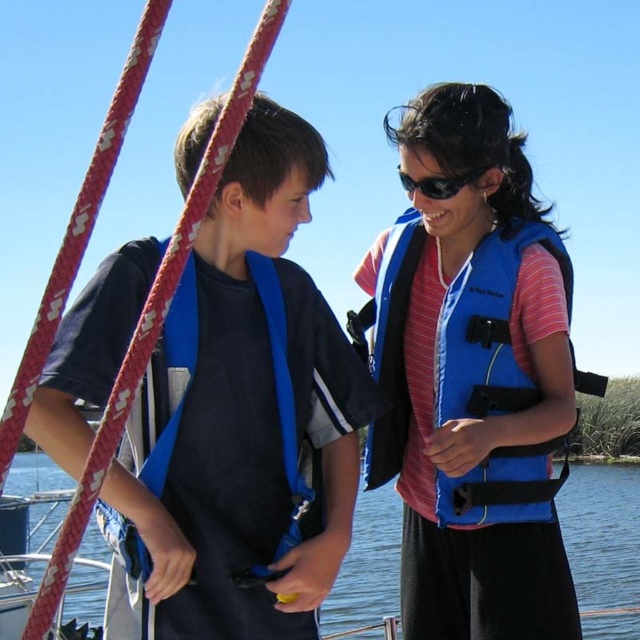
You are a safety inspector checking the equipment placement on a boat. You notice the blue fabric life jacket at center and the blue plastic goggles at upper center. According to safety regulations, life jackets must be placed above any other equipment. Is the current placement compliant?

The blue fabric life jacket at center is located below blue plastic goggles at upper center, which violates the safety regulation requiring life jackets to be placed above other equipment. The current placement is not compliant.

You are on a boat and need to secure your belongings. You have a blue fabric life jacket at left and blue water at center. Which item is closer to the right edge of the boat?

The blue fabric life jacket at left is positioned on the right side of blue water at center, so it is closer to the right edge of the boat.